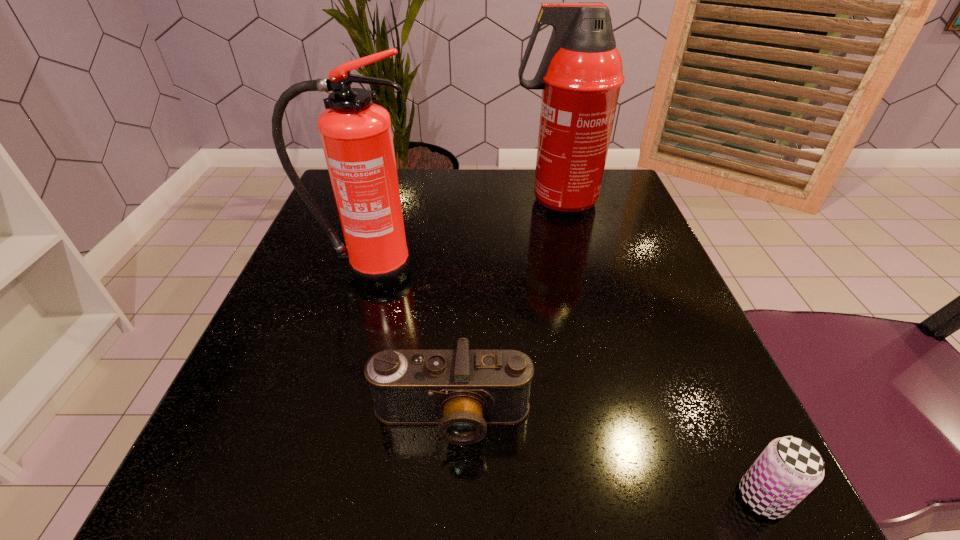
What are the coordinates of `object present at the near right corner` in the screenshot? It's located at (789, 468).

The width and height of the screenshot is (960, 540). In the image, there is a desktop. Find the location of `blank space at the far edge`. blank space at the far edge is located at coordinates pyautogui.click(x=511, y=188).

You are a GUI agent. You are given a task and a screenshot of the screen. Output one action in this format:
    pyautogui.click(x=<x>, y=<y>)
    Task: Click on the free space at the near edge of the desktop
    
    Given the screenshot: What is the action you would take?
    pyautogui.click(x=523, y=464)

At what (x,y) coordinates should I click in order to perform the action: click on vacant space at the left edge of the desktop. Please return your answer as a coordinate pair (x, y). The height and width of the screenshot is (540, 960). Looking at the image, I should click on (314, 246).

You are a GUI agent. You are given a task and a screenshot of the screen. Output one action in this format:
    pyautogui.click(x=<x>, y=<y>)
    Task: Click on the free space at the right edge of the desktop
    Image resolution: width=960 pixels, height=540 pixels.
    Given the screenshot: What is the action you would take?
    pyautogui.click(x=726, y=393)

In the image, there is a desktop. Identify the location of vacant area at the near left corner. (286, 509).

You are a GUI agent. You are given a task and a screenshot of the screen. Output one action in this format:
    pyautogui.click(x=<x>, y=<y>)
    Task: Click on the vacant space at the near right corner of the desktop
    The width and height of the screenshot is (960, 540).
    Given the screenshot: What is the action you would take?
    pyautogui.click(x=732, y=476)

Identify the location of free space between the third nearest object and the farthest object. The width and height of the screenshot is (960, 540). (462, 235).

Locate an element on the screen. This screenshot has height=540, width=960. free spot between the right fire extinguisher and the third farthest object is located at coordinates (504, 309).

I want to click on free space between the second farthest object and the nearest object, so click(564, 384).